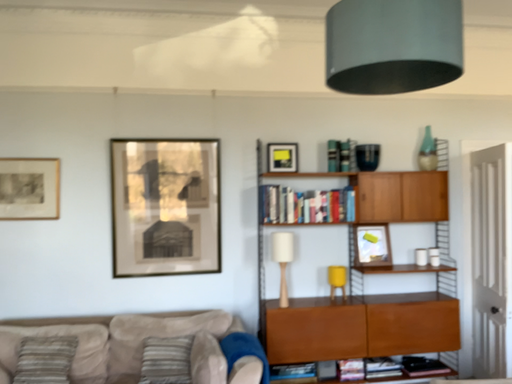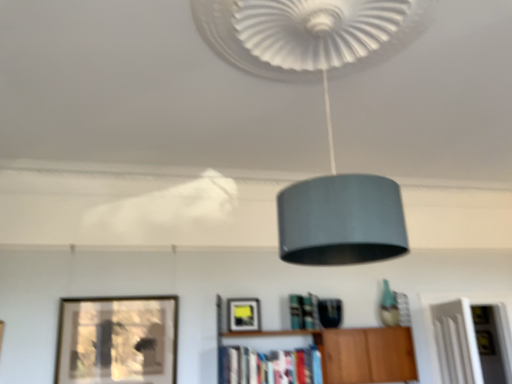
Question: How did the camera likely rotate when shooting the video?

Choices:
 (A) rotated upward
 (B) rotated downward

Answer: (A)